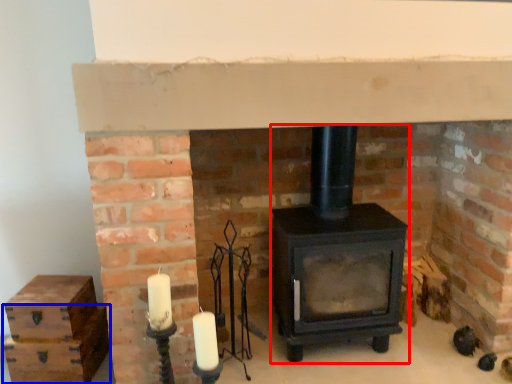
Question: Which of the following is the farthest to the observer, wood burning stove (highlighted by a red box) or drawer (highlighted by a blue box)?

Choices:
 (A) wood burning stove
 (B) drawer

Answer: (B)